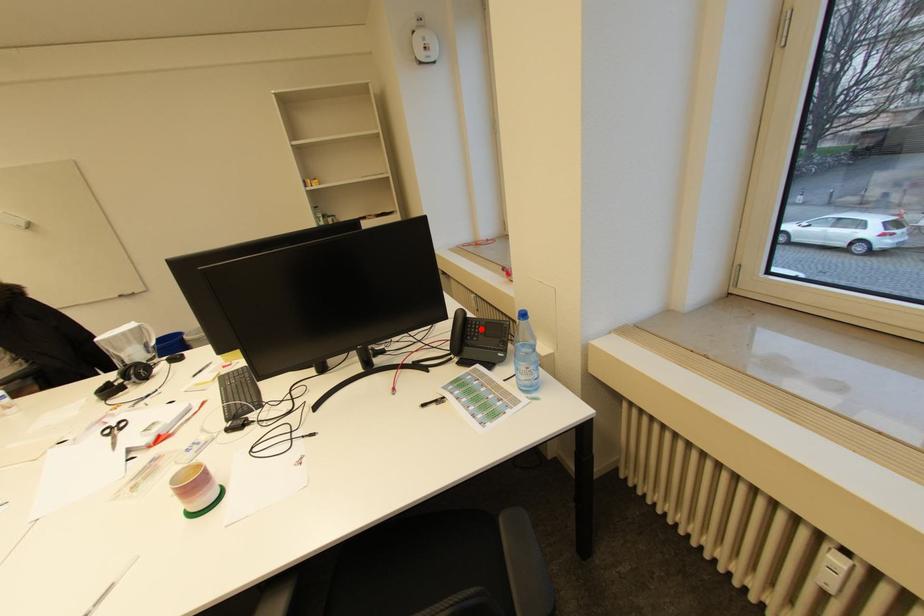
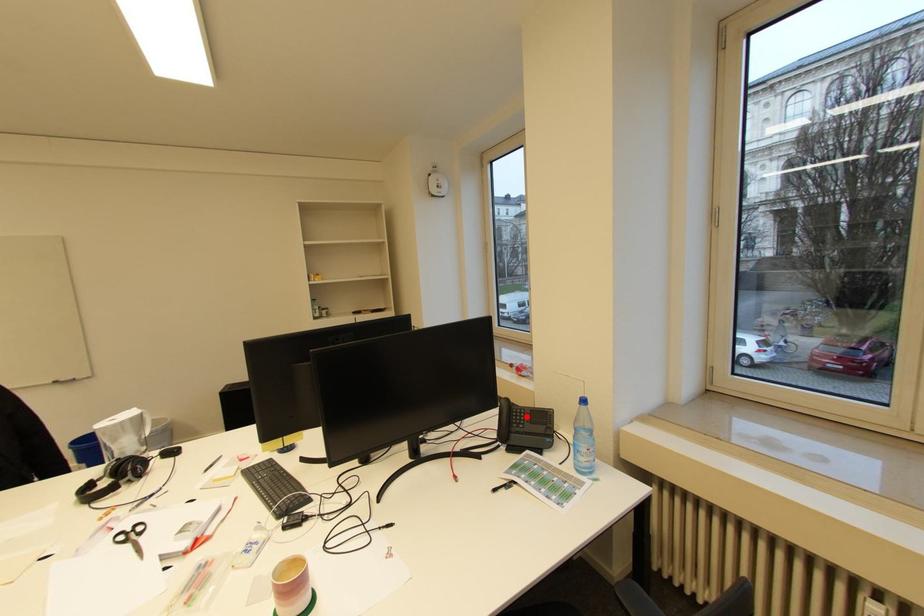
I am providing you with two images of the same scene from different viewpoints. A red point is marked on the first image and another point is marked on the second image. Is the red point in image1 aligned with the point shown in image2?

Yes